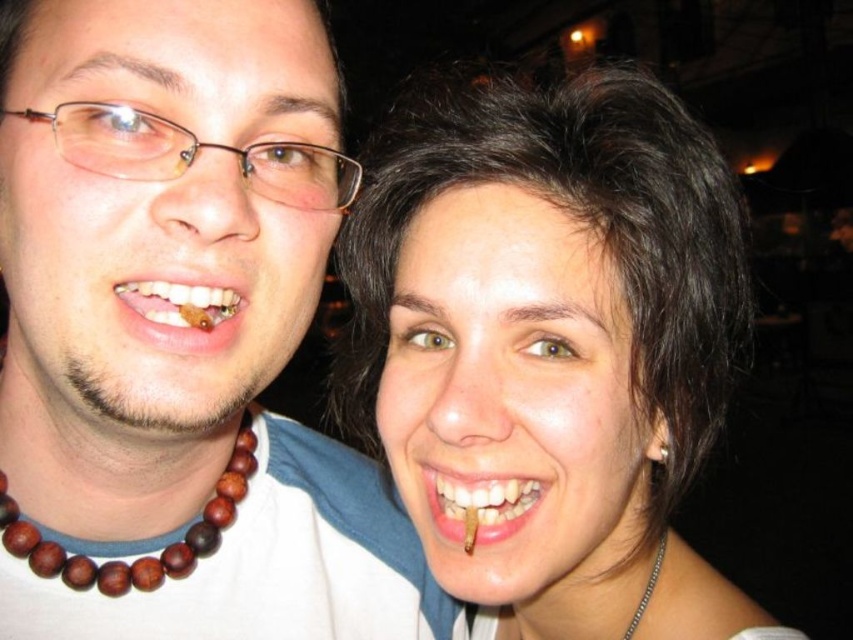
Question: Which point is farther from the camera taking this photo?

Choices:
 (A) (38, 541)
 (B) (199, 292)

Answer: (A)

Question: Which point is farther to the camera?

Choices:
 (A) brown wooden beads at left
 (B) teeth with brown stain at lower center
 (C) brown wood toothpick at lower left

Answer: (A)

Question: Estimate the real-world distances between objects in this image. Which object is closer to the dark brown hair at upper right?

Choices:
 (A) brown wooden beads at left
 (B) wooden bead necklace at left
 (C) brown plastic glasses at upper left

Answer: (B)

Question: Can you confirm if dark brown hair at upper right is bigger than teeth with brown stain at lower center?

Choices:
 (A) no
 (B) yes

Answer: (B)

Question: Is dark brown hair at upper right to the left of teeth with brown stain at lower center from the viewer's perspective?

Choices:
 (A) no
 (B) yes

Answer: (A)

Question: From the image, what is the correct spatial relationship of dark brown hair at upper right in relation to brown wood toothpick at lower left?

Choices:
 (A) left
 (B) right

Answer: (B)